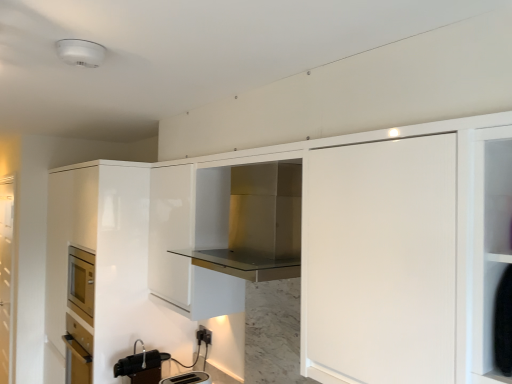
This screenshot has height=384, width=512. Describe the element at coordinates (204, 335) in the screenshot. I see `black plastic electric outlet at lower center` at that location.

Where is `black plastic electric outlet at lower center`? Image resolution: width=512 pixels, height=384 pixels. black plastic electric outlet at lower center is located at coordinates (204, 335).

Identify the location of stainless steel range hood at center, which is the first cabinetry in front-to-back order. (255, 223).

At what (x,y) coordinates should I click in order to perform the action: click on metallic silver faucet at lower center, marked as the 2th appliance in a right-to-left arrangement. Please return your answer as a coordinate pair (x, y). Looking at the image, I should click on (141, 366).

Describe the element at coordinates (6, 277) in the screenshot. This screenshot has height=384, width=512. I see `translucent glass screen door at left` at that location.

Where is `black plastic electric outlet at lower center`? This screenshot has height=384, width=512. black plastic electric outlet at lower center is located at coordinates (204, 335).

Is metallic silver faucet at lower center, placed as the 1th appliance when sorted from left to right, to the left or to the right of glossy white cabinet at left, the 2th cabinetry positioned from the front, in the image?

In the image, metallic silver faucet at lower center, placed as the 1th appliance when sorted from left to right, appears on the right side of glossy white cabinet at left, the 2th cabinetry positioned from the front.

From the image's perspective, which one is positioned lower, metallic silver faucet at lower center, marked as the 2th appliance in a right-to-left arrangement, or glossy white cabinet at left, the 2th cabinetry positioned from the front?

metallic silver faucet at lower center, marked as the 2th appliance in a right-to-left arrangement, appears lower in the image.

Where is `the 1st appliance in front of the glossy white cabinet at left, the 2th cabinetry positioned from the front`? The width and height of the screenshot is (512, 384). the 1st appliance in front of the glossy white cabinet at left, the 2th cabinetry positioned from the front is located at coordinates (141, 366).

Is metallic silver faucet at lower center, placed as the 1th appliance when sorted from left to right, surrounding glossy white cabinet at left, which ranks as the first cabinetry in back-to-front order?

Definitely not — glossy white cabinet at left, which ranks as the first cabinetry in back-to-front order, is not inside metallic silver faucet at lower center, placed as the 1th appliance when sorted from left to right.

Which object is more forward, metallic silver faucet at lower center, marked as the 2th appliance in a right-to-left arrangement, or black plastic electric outlet at lower center?

metallic silver faucet at lower center, marked as the 2th appliance in a right-to-left arrangement.

From a real-world perspective, is metallic silver faucet at lower center, marked as the 2th appliance in a right-to-left arrangement, positioned above or below black plastic electric outlet at lower center?

metallic silver faucet at lower center, marked as the 2th appliance in a right-to-left arrangement, is situated lower than black plastic electric outlet at lower center in the real world.

Is metallic silver faucet at lower center, placed as the 1th appliance when sorted from left to right, far from black plastic electric outlet at lower center?

That's not correct — metallic silver faucet at lower center, placed as the 1th appliance when sorted from left to right, is a little close to black plastic electric outlet at lower center.

Is stainless steel range hood at center, the first cabinetry when ordered from right to left, looking in the opposite direction of matte black toaster at lower center, arranged as the 2th appliance when viewed from the left?

stainless steel range hood at center, the first cabinetry when ordered from right to left, does not have its back to matte black toaster at lower center, arranged as the 2th appliance when viewed from the left.

Where is `cabinetry in front of the matte black toaster at lower center, acting as the first appliance starting from the right`? cabinetry in front of the matte black toaster at lower center, acting as the first appliance starting from the right is located at coordinates (255, 223).

From the image's perspective, relative to matte black toaster at lower center, acting as the first appliance starting from the right, is stainless steel range hood at center, the first cabinetry when ordered from right to left, above or below?

From the image's perspective, stainless steel range hood at center, the first cabinetry when ordered from right to left, appears above matte black toaster at lower center, acting as the first appliance starting from the right.

Which object is further away from the camera taking this photo, stainless steel range hood at center, which is the first cabinetry in front-to-back order, or matte black toaster at lower center, acting as the first appliance starting from the right?

Positioned behind is matte black toaster at lower center, acting as the first appliance starting from the right.

Can you confirm if translucent glass screen door at left is smaller than stainless steel range hood at center, the first cabinetry when ordered from right to left?

No.

There is a translucent glass screen door at left. Where is `the 2nd cabinetry above it (from the image's perspective)`? Image resolution: width=512 pixels, height=384 pixels. the 2nd cabinetry above it (from the image's perspective) is located at coordinates (255, 223).

Is translucent glass screen door at left beside stainless steel range hood at center, the 2th cabinetry viewed from the back?

translucent glass screen door at left is not next to stainless steel range hood at center, the 2th cabinetry viewed from the back, and they're not touching.

Considering the points (170, 377) and (208, 333), which point is behind, point (170, 377) or point (208, 333)?

Point (208, 333)

Is matte black toaster at lower center, acting as the first appliance starting from the right, inside or outside of black plastic electric outlet at lower center?

matte black toaster at lower center, acting as the first appliance starting from the right, lies outside black plastic electric outlet at lower center.

Image resolution: width=512 pixels, height=384 pixels. In order to click on appliance that is the 1st object to the left of the black plastic electric outlet at lower center, starting at the anchor in this screenshot , I will do `click(188, 378)`.

Does point (284, 256) lie in front of point (53, 214)?

That is True.

From the image's perspective, is stainless steel range hood at center, the 2th cabinetry viewed from the back, located above or below glossy white cabinet at left, positioned as the 1th cabinetry in left-to-right order?

stainless steel range hood at center, the 2th cabinetry viewed from the back, is above glossy white cabinet at left, positioned as the 1th cabinetry in left-to-right order.

Is stainless steel range hood at center, the 2th cabinetry viewed from the back, behind glossy white cabinet at left, acting as the 2th cabinetry starting from the right?

No, stainless steel range hood at center, the 2th cabinetry viewed from the back, is in front of glossy white cabinet at left, acting as the 2th cabinetry starting from the right.

From the image's perspective, is black plastic electric outlet at lower center positioned above or below translucent glass screen door at left?

From the image's perspective, black plastic electric outlet at lower center appears above translucent glass screen door at left.

Which is correct: black plastic electric outlet at lower center is inside translucent glass screen door at left, or outside of it?

black plastic electric outlet at lower center is spatially situated outside translucent glass screen door at left.

Who is shorter, black plastic electric outlet at lower center or translucent glass screen door at left?

Standing shorter between the two is black plastic electric outlet at lower center.

Consider the image. Is black plastic electric outlet at lower center to the right of translucent glass screen door at left from the viewer's perspective?

Yes, black plastic electric outlet at lower center is to the right of translucent glass screen door at left.

I want to click on the 1st appliance below the glossy white cabinet at left, positioned as the 1th cabinetry in left-to-right order (from the image's perspective), so click(x=141, y=366).

Identify the location of the 1st appliance in front of the black plastic electric outlet at lower center. The height and width of the screenshot is (384, 512). (141, 366).

Estimate the real-world distances between objects in this image. Which object is closer to stainless steel range hood at center, the first cabinetry when ordered from right to left, black plastic electric outlet at lower center or matte black toaster at lower center, arranged as the 2th appliance when viewed from the left?

black plastic electric outlet at lower center is closer to stainless steel range hood at center, the first cabinetry when ordered from right to left.

When comparing their distances from black plastic electric outlet at lower center, does metallic silver faucet at lower center, marked as the 2th appliance in a right-to-left arrangement, or translucent glass screen door at left seem further?

translucent glass screen door at left.

When comparing their distances from metallic silver faucet at lower center, marked as the 2th appliance in a right-to-left arrangement, does matte black toaster at lower center, arranged as the 2th appliance when viewed from the left, or translucent glass screen door at left seem closer?

The object closer to metallic silver faucet at lower center, marked as the 2th appliance in a right-to-left arrangement, is matte black toaster at lower center, arranged as the 2th appliance when viewed from the left.

From the image, which object appears to be farther from matte black toaster at lower center, acting as the first appliance starting from the right, glossy white cabinet at left, acting as the 2th cabinetry starting from the right, or translucent glass screen door at left?

Among the two, translucent glass screen door at left is located further to matte black toaster at lower center, acting as the first appliance starting from the right.

Based on their spatial positions, is translucent glass screen door at left or glossy white cabinet at left, acting as the 2th cabinetry starting from the right, closer to stainless steel range hood at center, the first cabinetry when ordered from right to left?

Among the two, glossy white cabinet at left, acting as the 2th cabinetry starting from the right, is located nearer to stainless steel range hood at center, the first cabinetry when ordered from right to left.

Which object lies nearer to the anchor point stainless steel range hood at center, the first cabinetry when ordered from right to left, metallic silver faucet at lower center, marked as the 2th appliance in a right-to-left arrangement, or black plastic electric outlet at lower center?

Among the two, black plastic electric outlet at lower center is located nearer to stainless steel range hood at center, the first cabinetry when ordered from right to left.

When comparing their distances from translucent glass screen door at left, does black plastic electric outlet at lower center or matte black toaster at lower center, acting as the first appliance starting from the right, seem closer?

matte black toaster at lower center, acting as the first appliance starting from the right, is positioned closer to the anchor translucent glass screen door at left.

Looking at the image, which one is located closer to glossy white cabinet at left, which ranks as the first cabinetry in back-to-front order, metallic silver faucet at lower center, marked as the 2th appliance in a right-to-left arrangement, or translucent glass screen door at left?

metallic silver faucet at lower center, marked as the 2th appliance in a right-to-left arrangement.

Locate an element on the screen. appliance between translucent glass screen door at left and matte black toaster at lower center, acting as the first appliance starting from the right, in the horizontal direction is located at coordinates (141, 366).

At what (x,y) coordinates should I click in order to perform the action: click on electric outlet between translucent glass screen door at left and stainless steel range hood at center, the 2th cabinetry viewed from the back, from left to right. Please return your answer as a coordinate pair (x, y). This screenshot has width=512, height=384. Looking at the image, I should click on (204, 335).

The width and height of the screenshot is (512, 384). I want to click on cabinetry between translucent glass screen door at left and metallic silver faucet at lower center, placed as the 1th appliance when sorted from left to right, so click(100, 252).

Locate an element on the screen. cabinetry situated between translucent glass screen door at left and matte black toaster at lower center, arranged as the 2th appliance when viewed from the left, from left to right is located at coordinates (100, 252).